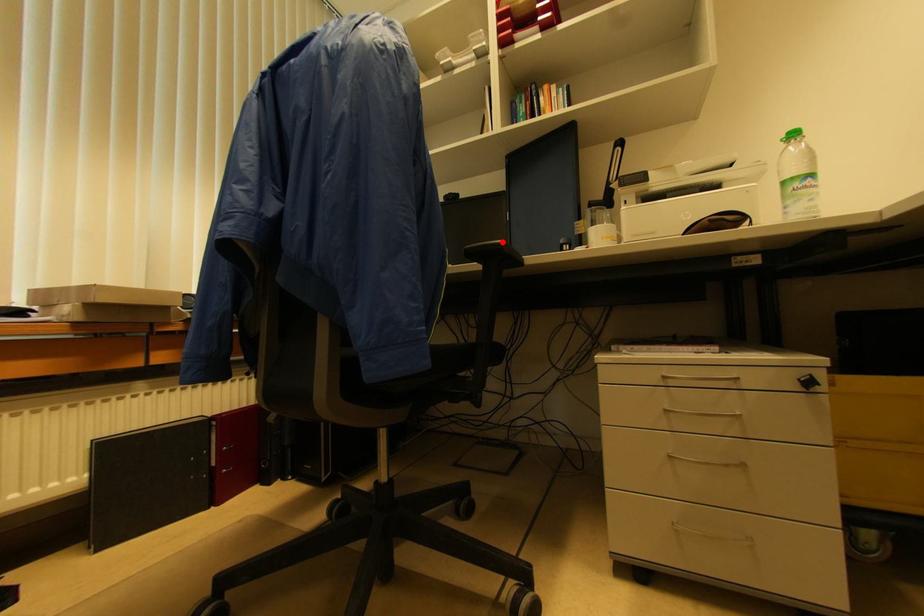
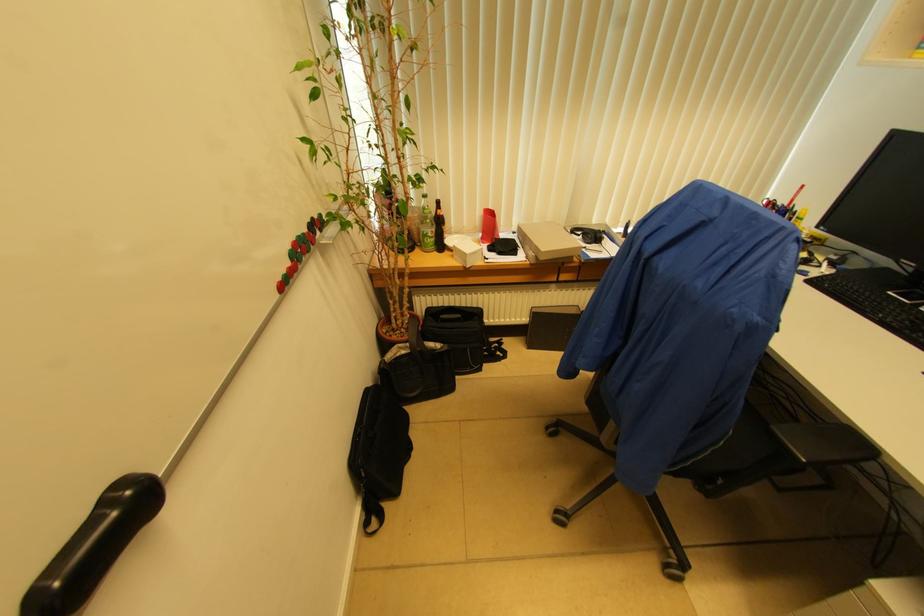
Question: I am providing you with two images of the same scene from different viewpoints. A red point is shown in image1. For the corresponding object point in image2, is it positioned nearer or farther from the camera?

Choices:
 (A) Nearer
 (B) Farther

Answer: (A)